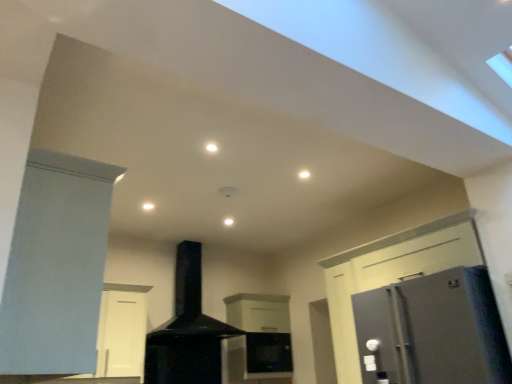
Question: Is satin silver refrigerator at right outside matte white cabinet at left, the first cabinetry when ordered from front to back?

Choices:
 (A) yes
 (B) no

Answer: (A)

Question: Does satin silver refrigerator at right lie in front of matte white cabinet at left, which is counted as the second cabinetry, starting from the back?

Choices:
 (A) yes
 (B) no

Answer: (B)

Question: From a real-world perspective, is satin silver refrigerator at right below matte white cabinet at left, the 1th cabinetry viewed from the left?

Choices:
 (A) no
 (B) yes

Answer: (B)

Question: Is satin silver refrigerator at right smaller than matte white cabinet at left, which is counted as the second cabinetry, starting from the back?

Choices:
 (A) no
 (B) yes

Answer: (B)

Question: Is satin silver refrigerator at right placed right next to matte white cabinet at left, which is counted as the second cabinetry, starting from the back?

Choices:
 (A) no
 (B) yes

Answer: (A)

Question: Is matte white cabinet at left, the 1th cabinetry viewed from the left, at the back of satin silver refrigerator at right?

Choices:
 (A) no
 (B) yes

Answer: (A)

Question: Is satin silver refrigerator at right not within black matte chimney at center?

Choices:
 (A) yes
 (B) no

Answer: (A)

Question: Is satin silver refrigerator at right turned away from black matte chimney at center?

Choices:
 (A) no
 (B) yes

Answer: (A)

Question: Is satin silver refrigerator at right positioned behind black matte chimney at center?

Choices:
 (A) yes
 (B) no

Answer: (B)

Question: From a real-world perspective, is satin silver refrigerator at right on black matte chimney at center?

Choices:
 (A) no
 (B) yes

Answer: (A)

Question: Can you confirm if satin silver refrigerator at right is thinner than black matte chimney at center?

Choices:
 (A) no
 (B) yes

Answer: (A)

Question: From a real-world perspective, is satin silver refrigerator at right physically below black matte chimney at center?

Choices:
 (A) yes
 (B) no

Answer: (A)

Question: Is white matte cabinet at center, placed as the second cabinetry when sorted from left to right, not close to satin silver refrigerator at right?

Choices:
 (A) no
 (B) yes

Answer: (B)